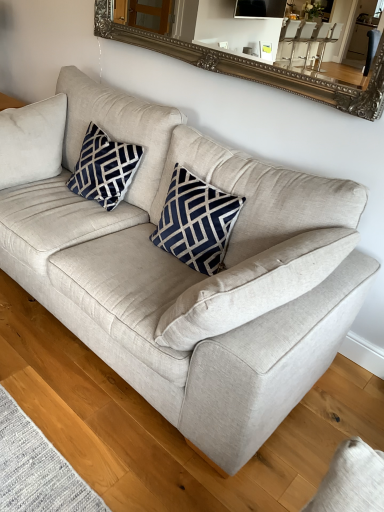
Question: Should I look upward or downward to see navy velvet pillow at upper left?

Choices:
 (A) up
 (B) down

Answer: (A)

Question: Are silver ornate mirror at upper center and navy blue textured pillow at center located far from each other?

Choices:
 (A) no
 (B) yes

Answer: (A)

Question: Is silver ornate mirror at upper center further to the viewer compared to navy blue textured pillow at center?

Choices:
 (A) yes
 (B) no

Answer: (B)

Question: Is silver ornate mirror at upper center thinner than navy blue textured pillow at center?

Choices:
 (A) no
 (B) yes

Answer: (B)

Question: From a real-world perspective, is silver ornate mirror at upper center located beneath navy blue textured pillow at center?

Choices:
 (A) yes
 (B) no

Answer: (B)

Question: Does silver ornate mirror at upper center lie in front of navy blue textured pillow at center?

Choices:
 (A) yes
 (B) no

Answer: (A)

Question: Considering the relative positions of silver ornate mirror at upper center and navy blue textured pillow at center in the image provided, is silver ornate mirror at upper center to the right of navy blue textured pillow at center from the viewer's perspective?

Choices:
 (A) no
 (B) yes

Answer: (B)

Question: Is navy blue textured pillow at center turned away from silver ornate mirror at upper center?

Choices:
 (A) no
 (B) yes

Answer: (A)

Question: Is navy blue textured pillow at center closer to the viewer compared to silver ornate mirror at upper center?

Choices:
 (A) no
 (B) yes

Answer: (A)

Question: Is navy blue textured pillow at center taller than silver ornate mirror at upper center?

Choices:
 (A) no
 (B) yes

Answer: (B)

Question: Is navy blue textured pillow at center positioned far away from silver ornate mirror at upper center?

Choices:
 (A) yes
 (B) no

Answer: (B)

Question: From the image's perspective, is navy blue textured pillow at center on silver ornate mirror at upper center?

Choices:
 (A) no
 (B) yes

Answer: (A)

Question: Can you confirm if navy blue textured pillow at center is positioned to the right of silver ornate mirror at upper center?

Choices:
 (A) no
 (B) yes

Answer: (A)

Question: Can you confirm if silver ornate mirror at upper center is wider than navy velvet pillow at upper left?

Choices:
 (A) no
 (B) yes

Answer: (A)